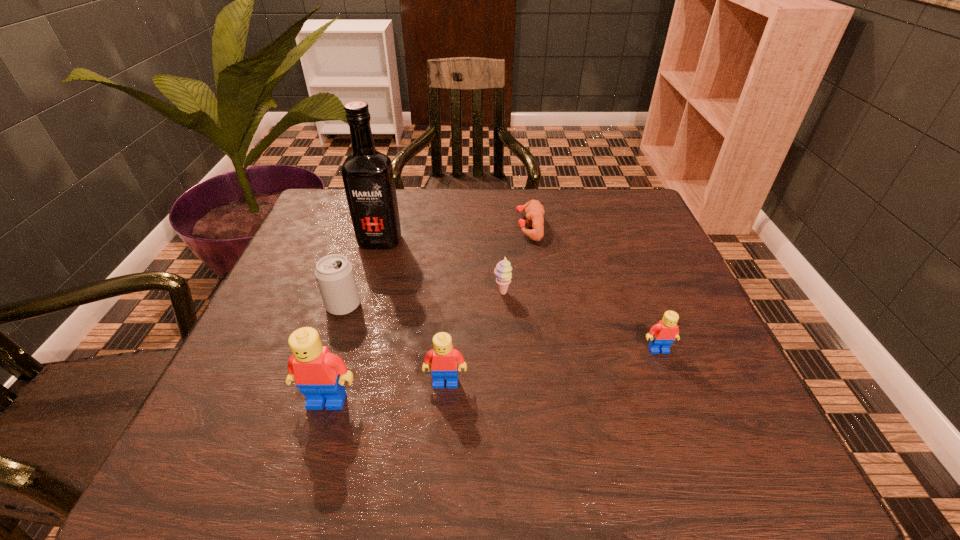
This screenshot has width=960, height=540. What are the coordinates of `can` in the screenshot? It's located at (334, 273).

Find the location of a particular element. This screenshot has height=540, width=960. free space located 0.070m on the face of the rightmost object is located at coordinates (672, 386).

Find the location of a particular element. vacant area situated with the gloves of the puncher facing forward is located at coordinates (376, 226).

Locate an element on the screen. free location located with the gloves of the puncher facing forward is located at coordinates (497, 226).

This screenshot has height=540, width=960. I want to click on vacant space located 0.280m with the gloves of the puncher facing forward, so click(x=411, y=226).

Locate an element on the screen. vacant space located 0.150m on the front-facing side of the tallest object is located at coordinates (365, 293).

What are the coordinates of `free space located 0.230m on the back of the sherbert` in the screenshot? It's located at pyautogui.click(x=498, y=228).

Where is `vacant region located on the back of the can`? Image resolution: width=960 pixels, height=540 pixels. vacant region located on the back of the can is located at coordinates (366, 238).

Identify the location of puncher positioned at the far edge. coord(534,211).

In order to click on liquor that is at the far edge in this screenshot , I will do `click(367, 174)`.